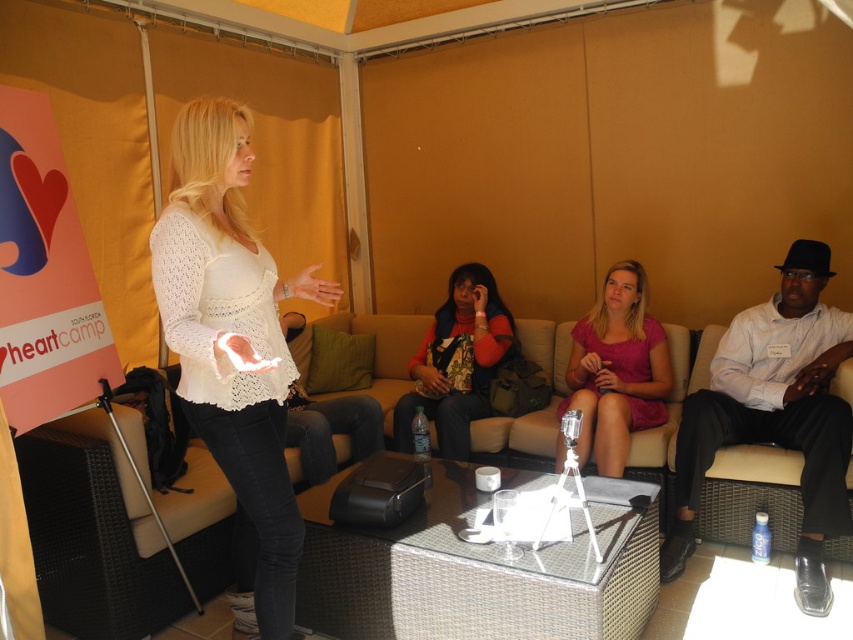
Question: Can you confirm if white shirt at center is positioned to the left of pink fabric dress at center?

Choices:
 (A) no
 (B) yes

Answer: (A)

Question: Which point is closer to the camera?

Choices:
 (A) red sweater at center
 (B) white lace top at center
 (C) white shirt at center
 (D) beige wicker couch at center

Answer: (B)

Question: Which point appears closest to the camera in this image?

Choices:
 (A) (170, 312)
 (B) (589, 324)
 (C) (453, 307)
 (D) (729, 422)

Answer: (A)

Question: Which object appears closest to the camera in this image?

Choices:
 (A) beige wicker couch at center
 (B) white lace top at center
 (C) red sweater at center
 (D) pink fabric dress at center

Answer: (B)

Question: Can you confirm if white lace top at center is positioned below red sweater at center?

Choices:
 (A) yes
 (B) no

Answer: (A)

Question: Is white lace top at center positioned before pink fabric dress at center?

Choices:
 (A) no
 (B) yes

Answer: (B)